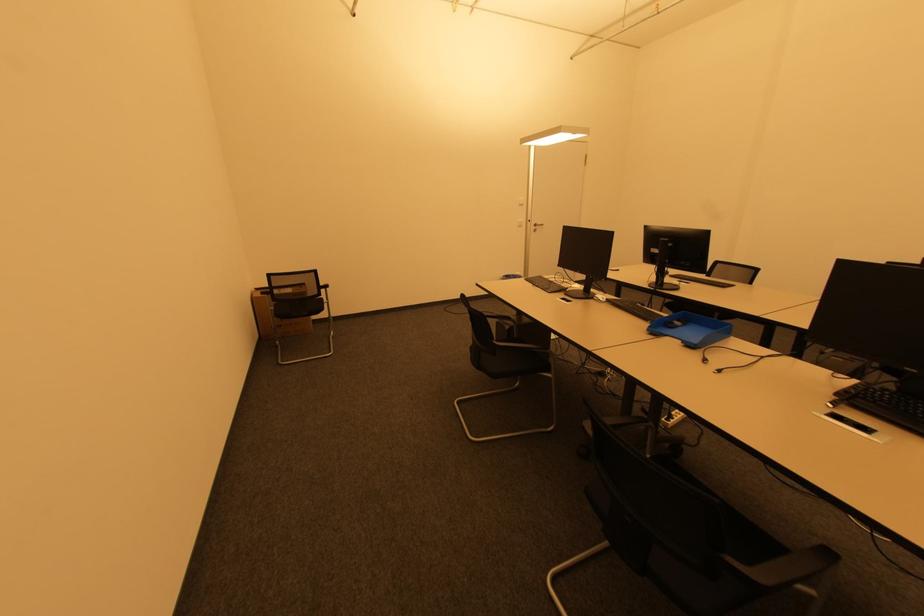
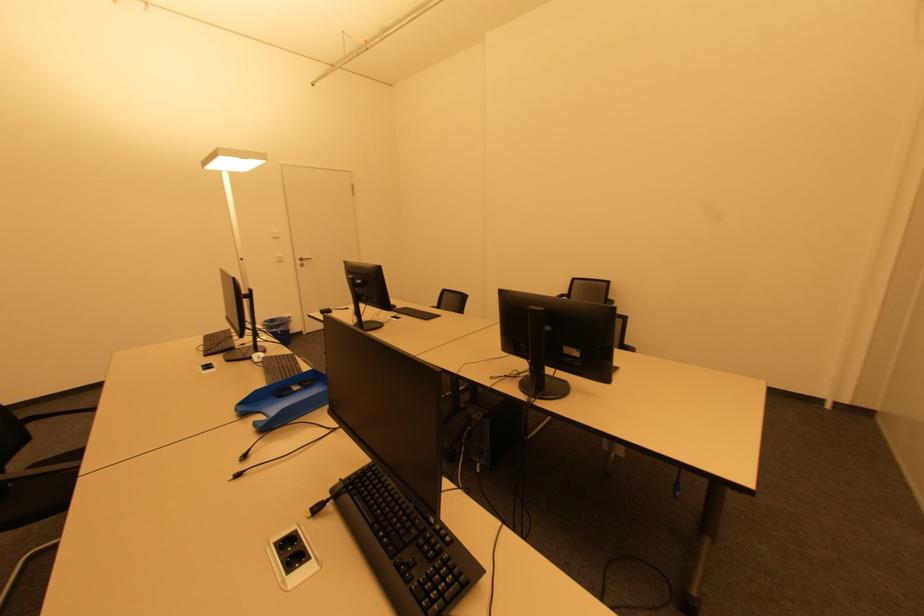
Question: In a continuous first-person perspective shot, in which direction is the camera moving?

Choices:
 (A) Left
 (B) Right
 (C) Forward
 (D) Backward

Answer: (B)